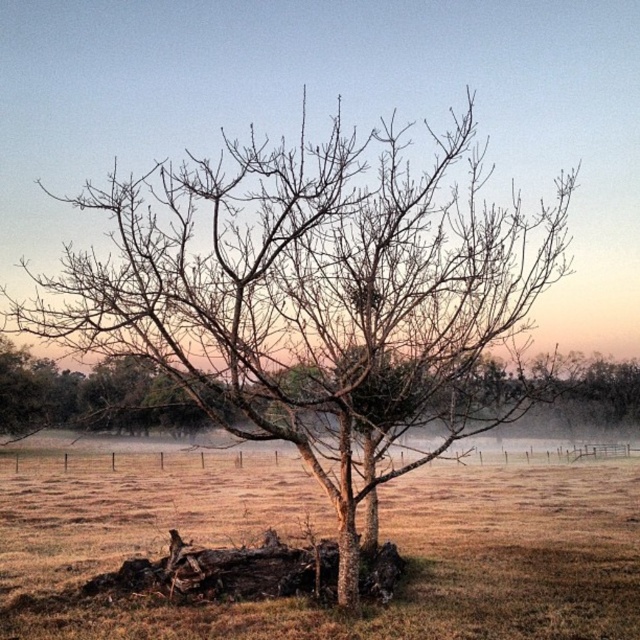
Based on the photo, you are standing at the origin point in the image. Which direction should you move to reach the brown grass at center?

The brown grass at center is located at point 0.886 in the x direction and 0.697 in the y direction, so you should move towards the right and up to reach it.